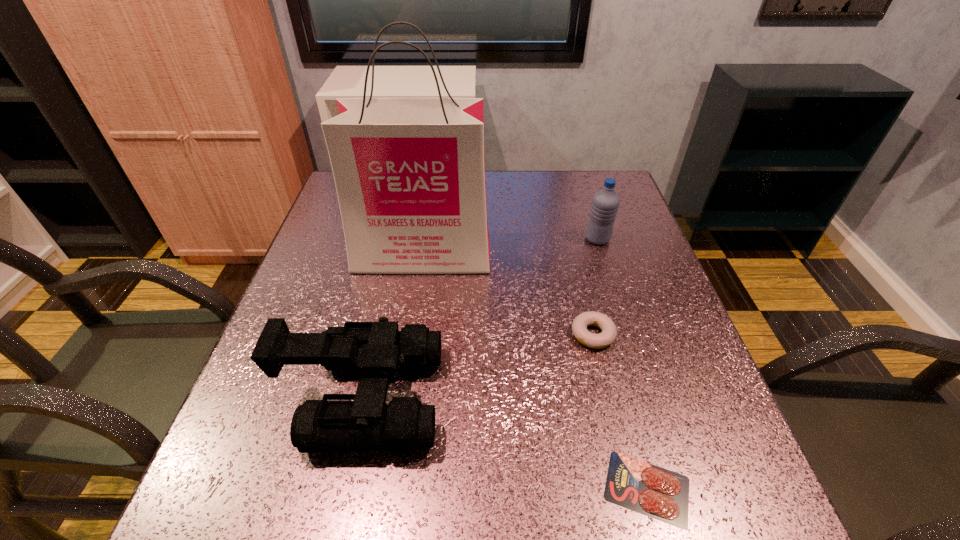
The width and height of the screenshot is (960, 540). In the image, there is a desktop. Identify the location of free space at the far right corner. (585, 189).

I want to click on free spot between the binoculars and the water bottle, so click(481, 318).

This screenshot has width=960, height=540. I want to click on empty space between the water bottle and the shopping bag, so click(x=510, y=247).

Locate an element on the screen. This screenshot has height=540, width=960. vacant space that's between the shopping bag and the doughnut is located at coordinates (508, 295).

Where is `vacant space that is in between the binoculars and the water bottle`? vacant space that is in between the binoculars and the water bottle is located at coordinates 481,318.

The image size is (960, 540). Identify the location of free space between the salami and the water bottle. (622, 363).

In order to click on vacant area that lies between the doughnut and the tallest object in this screenshot , I will do `click(508, 295)`.

The width and height of the screenshot is (960, 540). Find the location of `free space that is in between the water bottle and the tallest object`. free space that is in between the water bottle and the tallest object is located at coordinates (510, 247).

You are a GUI agent. You are given a task and a screenshot of the screen. Output one action in this format:
    pyautogui.click(x=<x>, y=<y>)
    Task: Click on the free space between the binoculars and the water bottle
    Image resolution: width=960 pixels, height=540 pixels.
    Given the screenshot: What is the action you would take?
    pyautogui.click(x=481, y=318)

Where is `object that is the second closest to the doughnut`? The height and width of the screenshot is (540, 960). object that is the second closest to the doughnut is located at coordinates (409, 173).